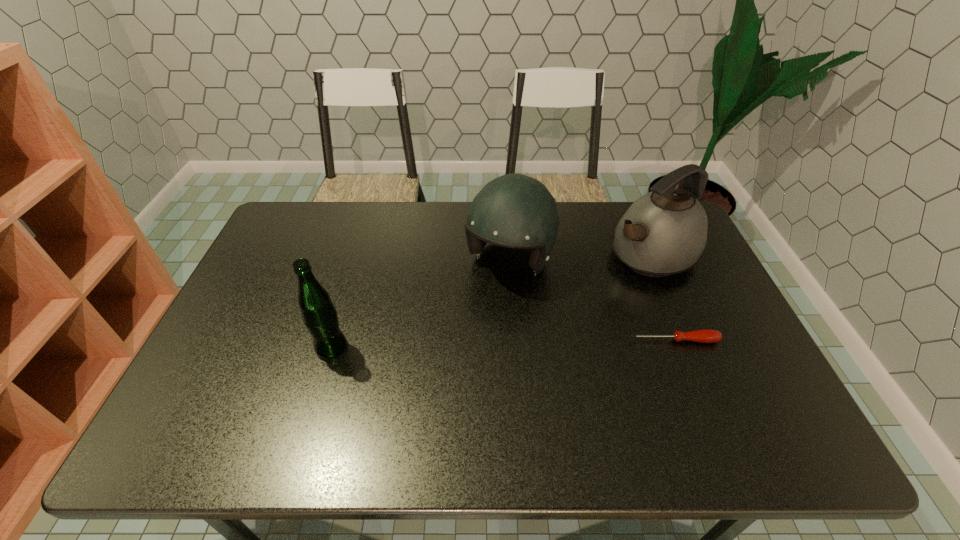
Identify the location of vacant area situated at the spout of the kettle. The height and width of the screenshot is (540, 960). (567, 300).

You are a GUI agent. You are given a task and a screenshot of the screen. Output one action in this format:
    pyautogui.click(x=<x>, y=<y>)
    Task: Click on the free space located 0.050m at the spout of the kettle
    The image size is (960, 540).
    Given the screenshot: What is the action you would take?
    pyautogui.click(x=604, y=279)

Find the location of a particular element. The image size is (960, 540). football helmet situated at the far edge is located at coordinates 514,210.

The width and height of the screenshot is (960, 540). Identify the location of kettle positioned at the far edge. (664, 232).

The height and width of the screenshot is (540, 960). I want to click on screwdriver present at the right edge, so click(704, 335).

Identify the location of kettle that is at the right edge. (664, 232).

Where is `object located at the far right corner`? object located at the far right corner is located at coordinates (664, 232).

At what (x,y) coordinates should I click in order to perform the action: click on vacant space at the far edge of the desktop. Please return your answer as a coordinate pair (x, y). Looking at the image, I should click on (564, 208).

In the image, there is a desktop. Where is `vacant space at the near right corner`? The height and width of the screenshot is (540, 960). vacant space at the near right corner is located at coordinates (735, 401).

Identify the location of vacant area that lies between the football helmet and the shortest object. (591, 300).